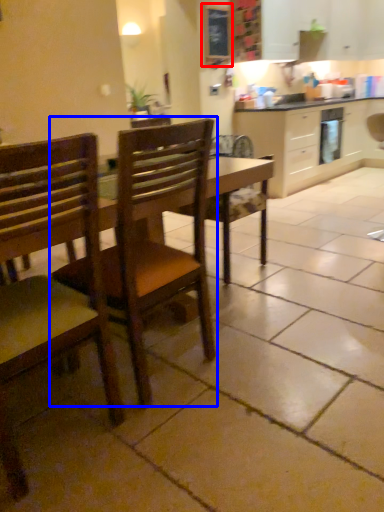
Question: Which of the following is the closest to the observer, bulletin board (highlighted by a red box) or chair (highlighted by a blue box)?

Choices:
 (A) bulletin board
 (B) chair

Answer: (B)